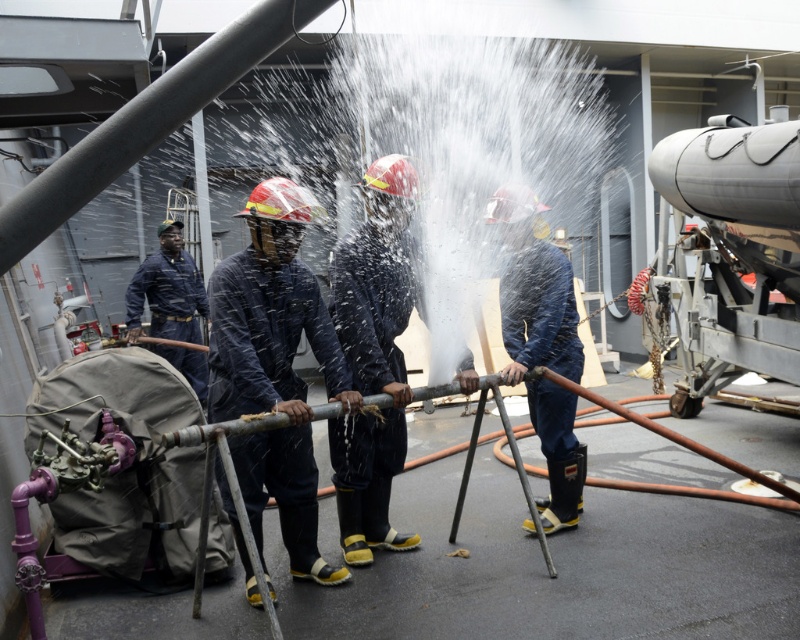
Does dark blue uniform at center have a smaller size compared to blue rubber boots at center?

No.

Can you confirm if dark blue uniform at center is wider than blue rubber boots at center?

Indeed, dark blue uniform at center has a greater width compared to blue rubber boots at center.

The image size is (800, 640). Identify the location of dark blue uniform at center. (274, 369).